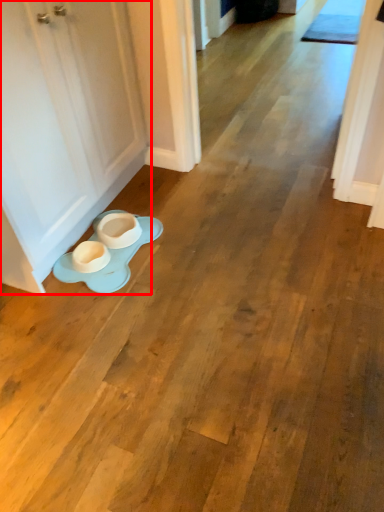
Question: From the image's perspective, what is the correct spatial relationship of door (annotated by the red box) in relation to saucer?

Choices:
 (A) above
 (B) below

Answer: (A)